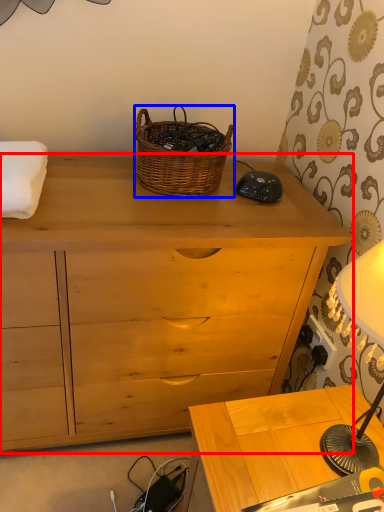
Question: Which object appears closest to the camera in this image, chest of drawers (highlighted by a red box) or picnic basket (highlighted by a blue box)?

Choices:
 (A) chest of drawers
 (B) picnic basket

Answer: (A)